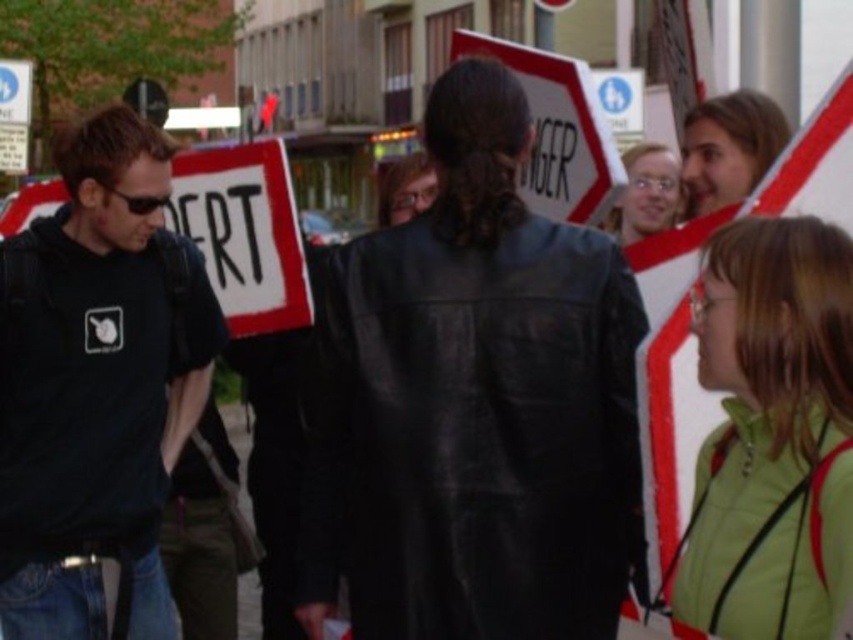
Question: Which object is positioned closest to the matte black jacket at upper right?

Choices:
 (A) black matte t-shirt at left
 (B) light brown hair at upper right

Answer: (B)

Question: Is black leather jacket at center positioned in front of matte black jacket at upper right?

Choices:
 (A) no
 (B) yes

Answer: (B)

Question: Which object is closer to the camera taking this photo?

Choices:
 (A) black leather jacket at center
 (B) black matte t-shirt at left
 (C) matte black jacket at upper right
 (D) light brown hair at upper right

Answer: (A)

Question: Can you confirm if black matte t-shirt at left is smaller than matte black jacket at upper right?

Choices:
 (A) no
 (B) yes

Answer: (A)

Question: Does black leather jacket at center have a larger size compared to matte black jacket at upper right?

Choices:
 (A) yes
 (B) no

Answer: (A)

Question: Which point appears closest to the camera in this image?

Choices:
 (A) (701, 196)
 (B) (674, 198)
 (C) (103, 627)
 (D) (569, 618)

Answer: (D)